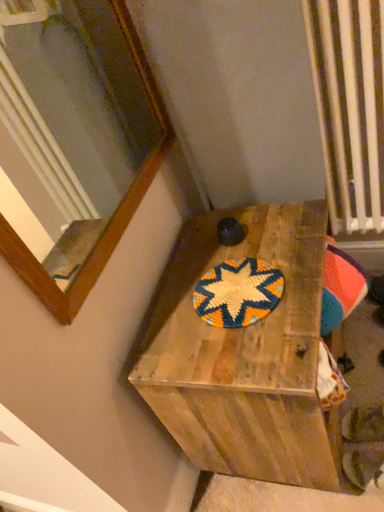
This screenshot has width=384, height=512. Find the location of `vacant area to the right of brightly woven mat at center`. vacant area to the right of brightly woven mat at center is located at coordinates (293, 258).